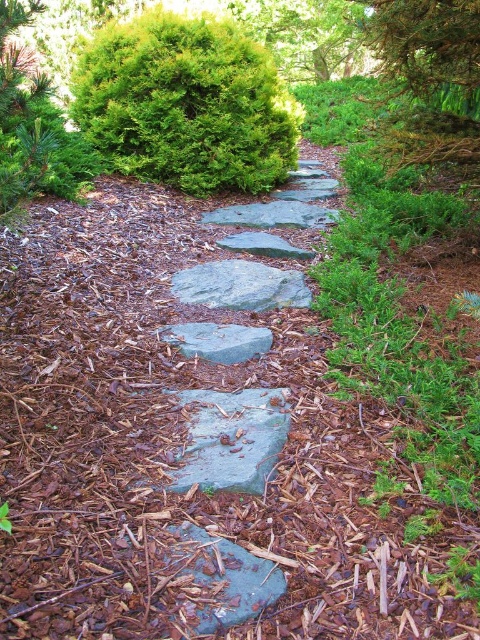
Question: Considering the real-world distances, which object is closest to the gray/rough stone at center?

Choices:
 (A) green rough stone at center
 (B) gray smooth stone at center

Answer: (B)

Question: In this image, where is gray rough stone at center located relative to gray/rough stone at center?

Choices:
 (A) right
 (B) left

Answer: (B)

Question: Does gray/rough rock at center appear over gray smooth stone at center?

Choices:
 (A) yes
 (B) no

Answer: (B)

Question: Which point is closer to the camera taking this photo?

Choices:
 (A) (252, 236)
 (B) (197, 116)

Answer: (A)

Question: Which object is farther from the camera taking this photo?

Choices:
 (A) gray/rough stone at center
 (B) gray rough stone at center
 (C) gray smooth stone at center

Answer: (C)

Question: Can you confirm if green textured bush at upper left is positioned to the right of gray rough stone at center?

Choices:
 (A) no
 (B) yes

Answer: (A)